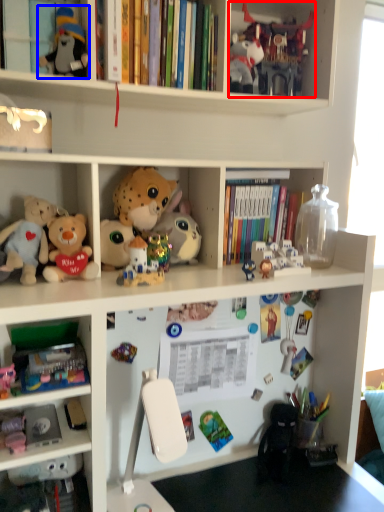
Question: Which object appears farthest to the camera in this image, toy (highlighted by a red box) or toy (highlighted by a blue box)?

Choices:
 (A) toy
 (B) toy

Answer: (A)